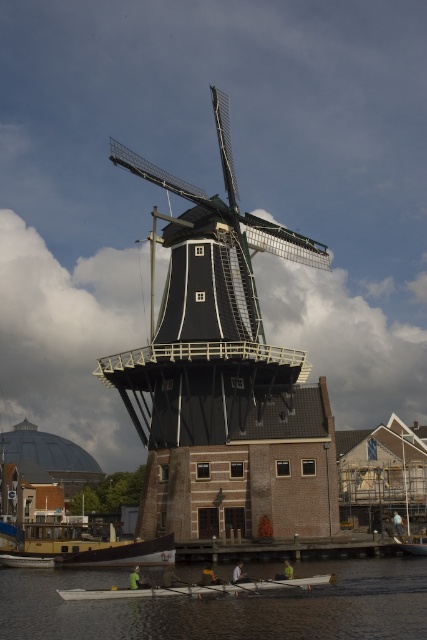
You are a tourist standing on the brown wooden dock at lower center. You see the white plastic boat at lower center nearby. If you want to jump into the boat, will you be able to reach it?

The distance between the brown wooden dock at lower center and the white plastic boat at lower center is 10.94 meters. Since this distance is quite large, jumping into the boat from the dock is not feasible and would be dangerous. It is recommended to use a safer method like a ladder or a bridge to board the boat.

You are a tourist visiting the Dutch windmill and want to tie your white plastic boat at lower center to the brown wooden dock at lower center. However, you notice that the dock is narrower than the boat. Will the dock be able to support the boat securely?

The brown wooden dock at lower center is narrower than the white plastic boat at lower center, so it may not provide sufficient support for the boat. It is advisable to look for a wider dock or alternative anchoring point to ensure stability.

You are a tourist visiting the Dutch windmill and want to take a photo that includes both the black wooden windmill at center and the transparent water at lower center. Considering their sizes, which object should you frame first to ensure both are visible in the photo?

The black wooden windmill at center is bigger than transparent water at lower center, so you should frame the black wooden windmill at center first to ensure both are visible in the photo.